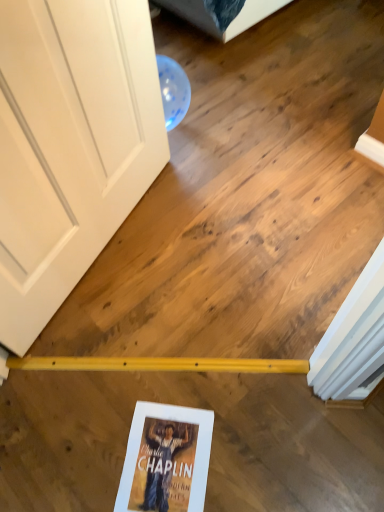
Locate an element on the screen. This screenshot has height=512, width=384. free spot behind hardcover book at lower center is located at coordinates (158, 374).